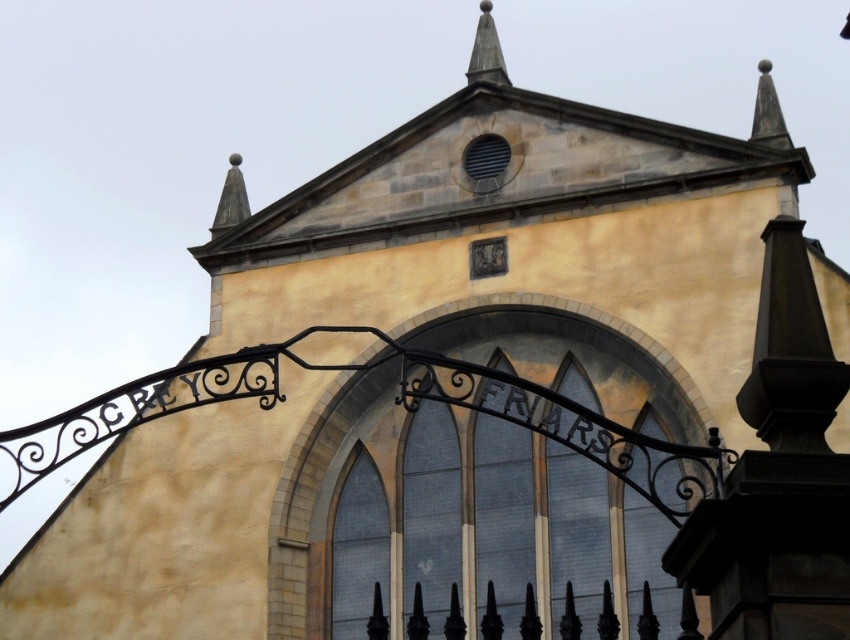
Is smooth gray spire at upper center in front of matte stone spire at upper center?

Yes, it is.

How much distance is there between smooth gray spire at upper center and matte stone spire at upper center?

13.68 meters

You are a GUI agent. You are given a task and a screenshot of the screen. Output one action in this format:
    pyautogui.click(x=<x>, y=<y>)
    Task: Click on the smooth gray spire at upper center
    The image size is (850, 640).
    Given the screenshot: What is the action you would take?
    pyautogui.click(x=486, y=51)